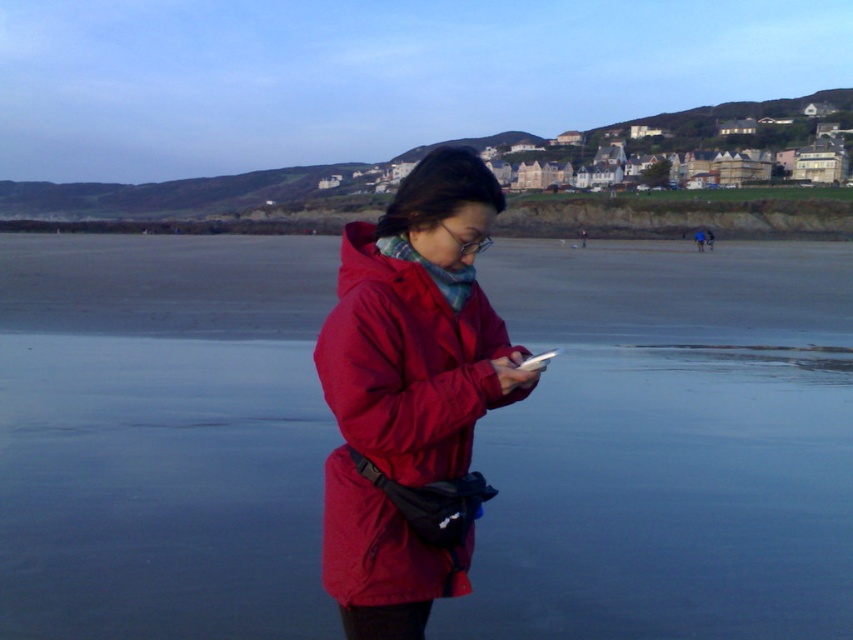
Question: Which object appears closest to the camera in this image?

Choices:
 (A) transparent water at center
 (B) matte red jacket at center

Answer: (B)

Question: Which of the following is the closest to the observer?

Choices:
 (A) [430, 580]
 (B) [79, 566]

Answer: (A)

Question: Where is transparent water at center located in relation to matte red jacket at center in the image?

Choices:
 (A) above
 (B) below

Answer: (A)

Question: Considering the relative positions of transparent water at center and matte red jacket at center in the image provided, where is transparent water at center located with respect to matte red jacket at center?

Choices:
 (A) left
 (B) right

Answer: (B)

Question: Does transparent water at center come in front of matte red jacket at center?

Choices:
 (A) yes
 (B) no

Answer: (B)

Question: Which point appears farthest from the camera in this image?

Choices:
 (A) (349, 440)
 (B) (689, 292)

Answer: (B)